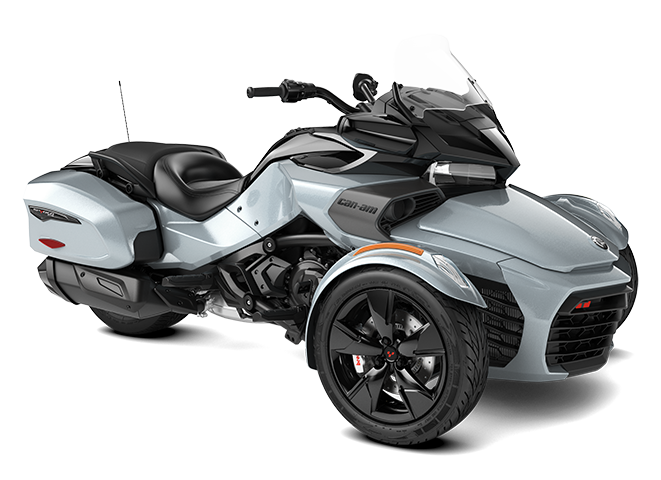
Find the location of a particular element. The height and width of the screenshot is (480, 661). lights is located at coordinates (449, 269), (465, 172), (609, 219).